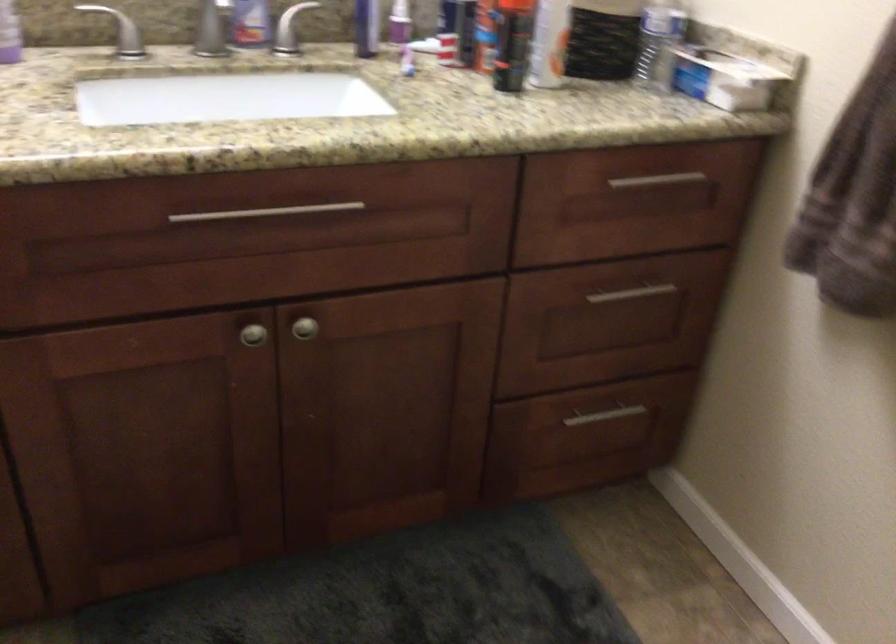
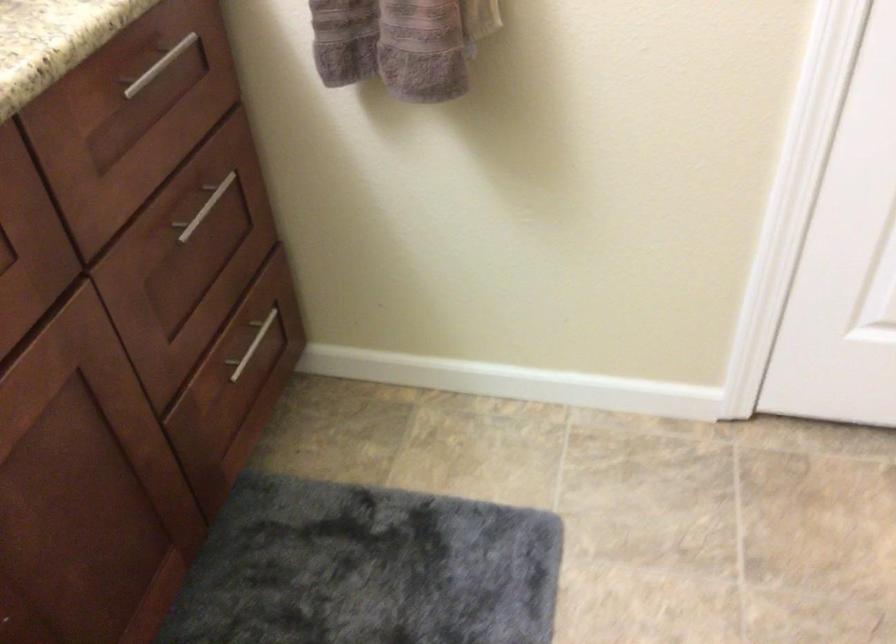
Locate, in the second image, the point that corresponds to [652,180] in the first image.

(159, 66)